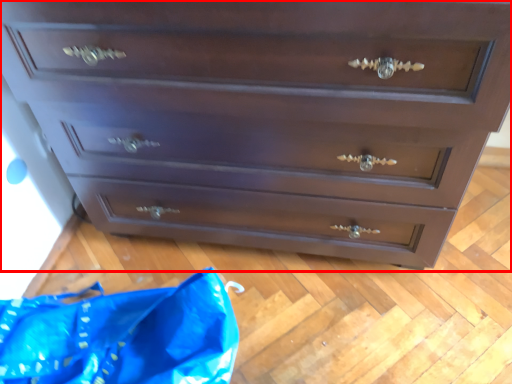
Question: In this image, where is chest of drawers (annotated by the red box) located relative to material?

Choices:
 (A) left
 (B) right

Answer: (B)